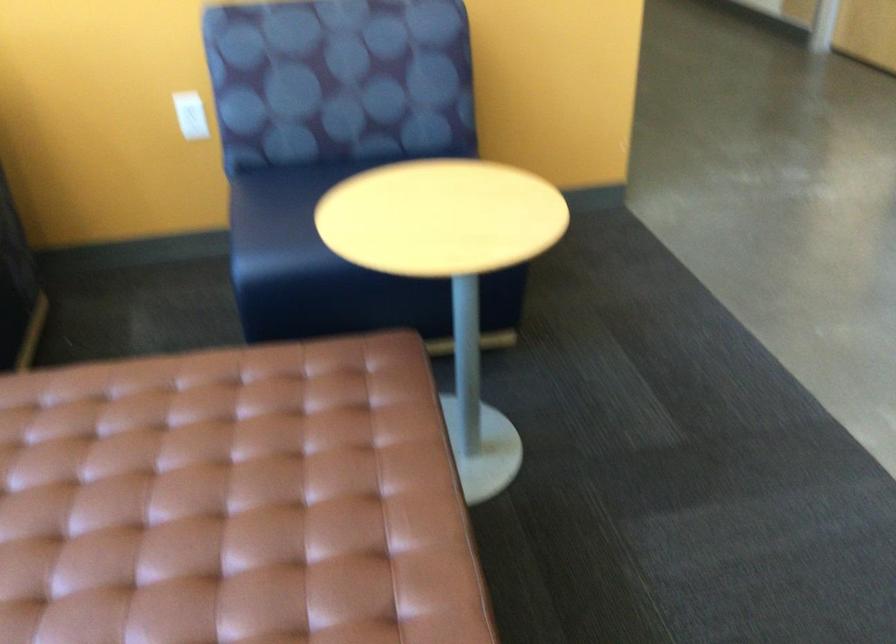
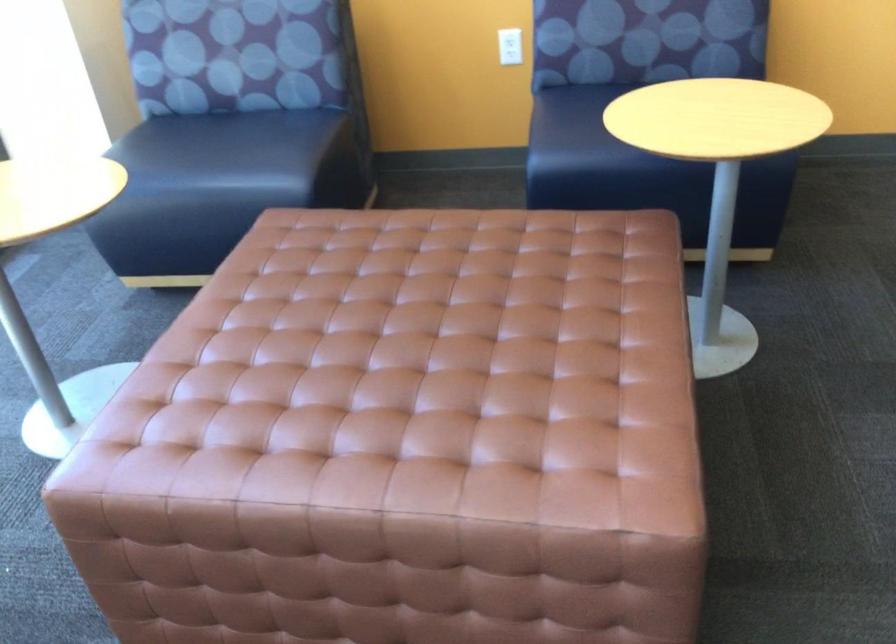
Which direction would the cameraman need to move to produce the second image?

The cameraman walked toward right, backward.